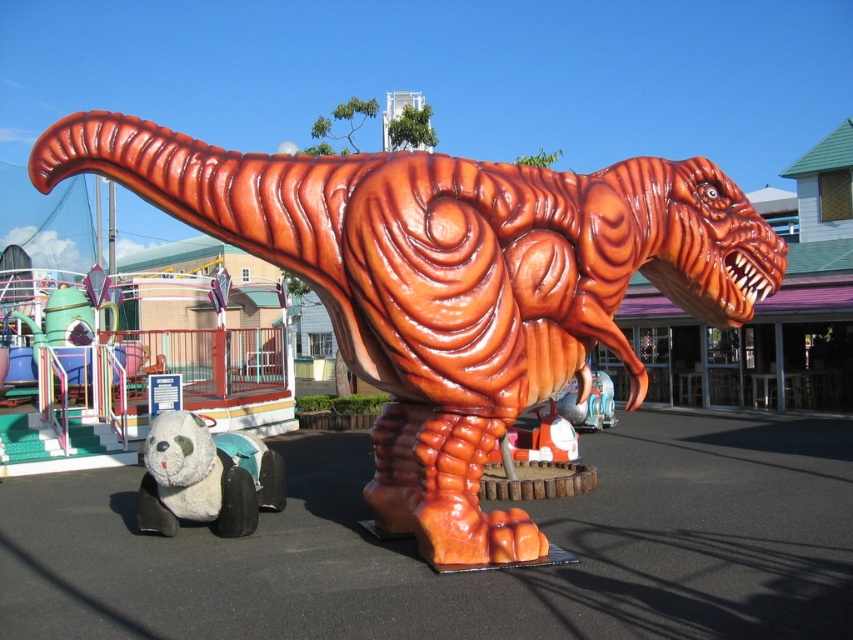
Question: Which point is closer to the camera taking this photo?

Choices:
 (A) (236, 528)
 (B) (397, 285)

Answer: (B)

Question: Is shiny orange dinosaur at center positioned at the back of white plush panda at lower left?

Choices:
 (A) yes
 (B) no

Answer: (B)

Question: Which of the following is the closest to the observer?

Choices:
 (A) white plush panda at lower left
 (B) shiny orange dinosaur at center

Answer: (B)

Question: Which point appears farthest from the camera in this image?

Choices:
 (A) (169, 467)
 (B) (374, 362)

Answer: (A)

Question: Can you confirm if shiny orange dinosaur at center is positioned below white plush panda at lower left?

Choices:
 (A) no
 (B) yes

Answer: (A)

Question: Does shiny orange dinosaur at center appear on the right side of white plush panda at lower left?

Choices:
 (A) yes
 (B) no

Answer: (A)